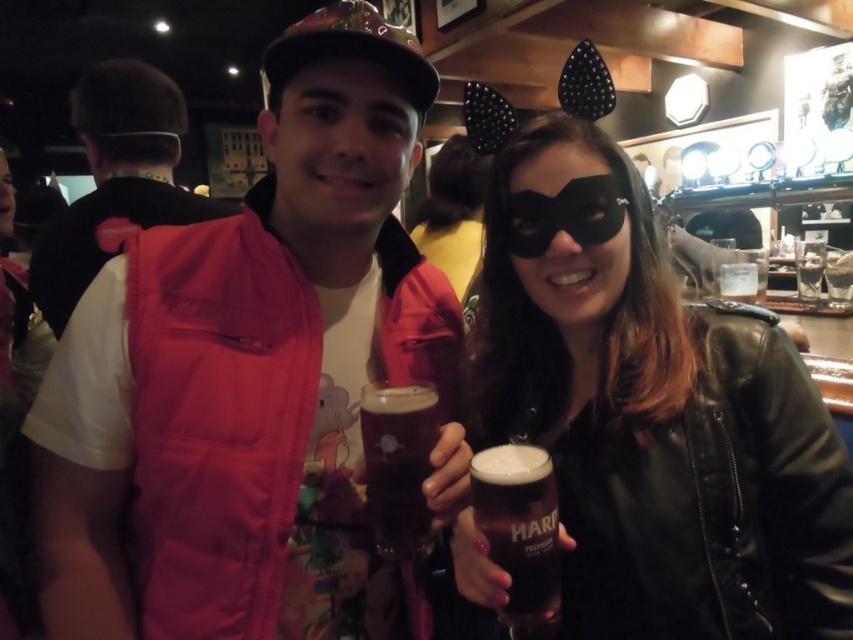
Is point (642, 589) farther from viewer compared to point (490, 497)?

Yes, point (642, 589) is farther from viewer.

Is black leather mask at center positioned behind dark brown glass at center?

Yes, it is.

Who is more forward, (650, 596) or (523, 557)?

Point (523, 557) is more forward.

This screenshot has height=640, width=853. What are the coordinates of `black leather mask at center` in the screenshot? It's located at (651, 412).

Does pink fabric vest at center have a larger size compared to clear glass at upper right?

Yes, pink fabric vest at center is bigger than clear glass at upper right.

Between point (276, 246) and point (753, 294), which one is positioned behind?

Point (753, 294)

Locate an element on the screen. This screenshot has width=853, height=640. pink fabric vest at center is located at coordinates (245, 355).

What are the coordinates of `pink fabric vest at center` in the screenshot? It's located at (245, 355).

Measure the distance between pink fabric vest at center and dark amber glass at center.

pink fabric vest at center is 19.67 centimeters away from dark amber glass at center.

Does point (241, 218) come in front of point (372, 428)?

No, (241, 218) is behind (372, 428).

Locate an element on the screen. This screenshot has width=853, height=640. pink fabric vest at center is located at coordinates (245, 355).